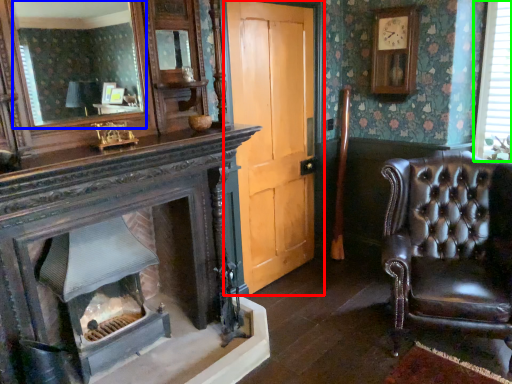
Question: Which object is positioned closest to door (highlighted by a red box)? Select from mirror (highlighted by a blue box) and window (highlighted by a green box).

Choices:
 (A) mirror
 (B) window

Answer: (B)